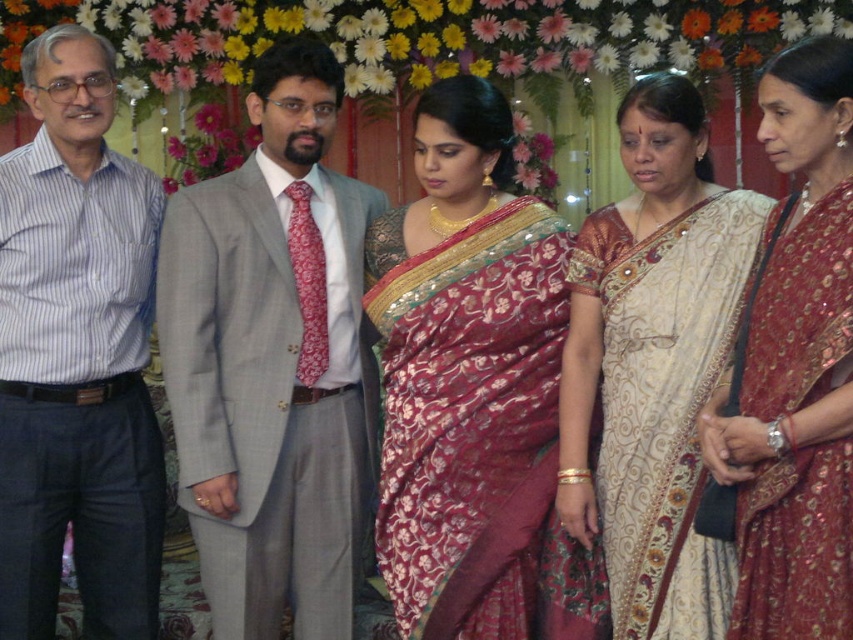
Measure the distance between striped cotton shirt at left and camera.

The distance of striped cotton shirt at left from camera is 3.14 meters.

Can you confirm if striped cotton shirt at left is shorter than white silk saree at center?

No, striped cotton shirt at left is not shorter than white silk saree at center.

The height and width of the screenshot is (640, 853). I want to click on striped cotton shirt at left, so click(x=76, y=355).

Where is `striped cotton shirt at left`? This screenshot has height=640, width=853. striped cotton shirt at left is located at coordinates (76, 355).

Which is in front, point (444, 113) or point (737, 508)?

Point (737, 508)

Does point (495, 568) come farther from viewer compared to point (848, 100)?

Yes.

This screenshot has height=640, width=853. Identify the location of maroon silk saree at center. (466, 374).

Describe the element at coordinates (273, 362) in the screenshot. The height and width of the screenshot is (640, 853). I see `light gray suit at center` at that location.

Locate an element on the screen. light gray suit at center is located at coordinates (273, 362).

Where is `light gray suit at center`? This screenshot has height=640, width=853. light gray suit at center is located at coordinates (273, 362).